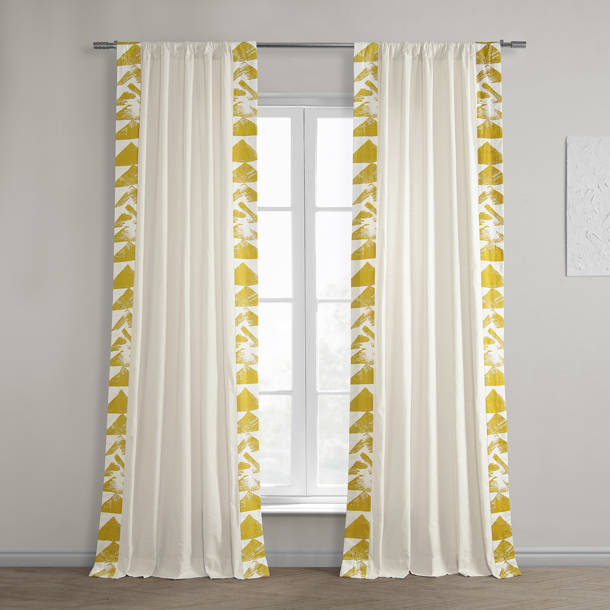
In order to click on wall decor in this screenshot , I will do `click(593, 204)`.